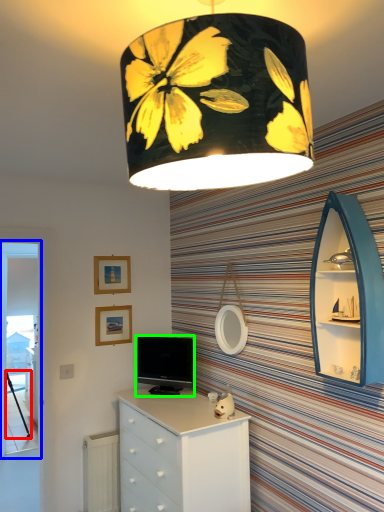
Question: Considering the real-world distances, which object is farthest from tripod (highlighted by a red box)? screen door (highlighted by a blue box) or television (highlighted by a green box)?

Choices:
 (A) screen door
 (B) television

Answer: (B)